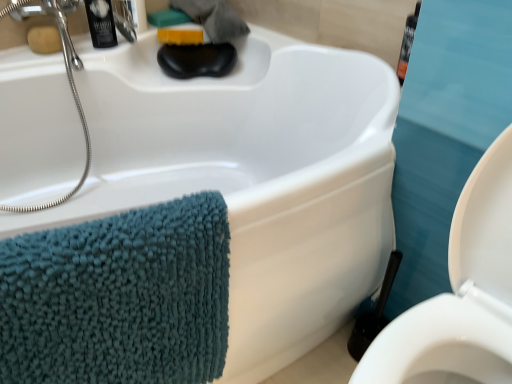
Question: Is black plastic toilet brush at lower right facing towards yellow sponge at upper center, which is counted as the second soap, starting from the left?

Choices:
 (A) yes
 (B) no

Answer: (B)

Question: From a real-world perspective, is black plastic toilet brush at lower right positioned under yellow sponge at upper center, which ranks as the 1th soap in right-to-left order, based on gravity?

Choices:
 (A) yes
 (B) no

Answer: (A)

Question: Is black plastic toilet brush at lower right placed right next to yellow sponge at upper center, which is the first soap from back to front?

Choices:
 (A) no
 (B) yes

Answer: (A)

Question: From the image's perspective, does black plastic toilet brush at lower right appear higher than yellow sponge at upper center, which is the first soap from back to front?

Choices:
 (A) no
 (B) yes

Answer: (A)

Question: Is black plastic toilet brush at lower right taller than yellow sponge at upper center, which is the first soap from back to front?

Choices:
 (A) yes
 (B) no

Answer: (A)

Question: From a real-world perspective, is black plastic toilet brush at lower right physically above yellow sponge at upper center, which appears as the 2th soap when viewed from the front?

Choices:
 (A) no
 (B) yes

Answer: (A)

Question: Does satin nickel faucet at upper left lie in front of matte brown soap at upper left, the first soap when ordered from left to right?

Choices:
 (A) yes
 (B) no

Answer: (B)

Question: Considering the relative sizes of satin nickel faucet at upper left and matte brown soap at upper left, which is counted as the 2th soap, starting from the right, in the image provided, is satin nickel faucet at upper left thinner than matte brown soap at upper left, which is counted as the 2th soap, starting from the right,?

Choices:
 (A) yes
 (B) no

Answer: (B)

Question: From the image's perspective, is satin nickel faucet at upper left beneath matte brown soap at upper left, which ranks as the first soap in front-to-back order?

Choices:
 (A) yes
 (B) no

Answer: (B)

Question: Are satin nickel faucet at upper left and matte brown soap at upper left, the first soap when ordered from left to right, beside each other?

Choices:
 (A) yes
 (B) no

Answer: (B)

Question: Considering the relative sizes of satin nickel faucet at upper left and matte brown soap at upper left, which ranks as the first soap in front-to-back order, in the image provided, is satin nickel faucet at upper left shorter than matte brown soap at upper left, which ranks as the first soap in front-to-back order,?

Choices:
 (A) yes
 (B) no

Answer: (B)

Question: Is satin nickel faucet at upper left oriented away from matte brown soap at upper left, the 2th soap in the back-to-front sequence?

Choices:
 (A) yes
 (B) no

Answer: (B)

Question: Is teal chenille towel at left aimed at matte brown soap at upper left, the first soap when ordered from left to right?

Choices:
 (A) no
 (B) yes

Answer: (A)